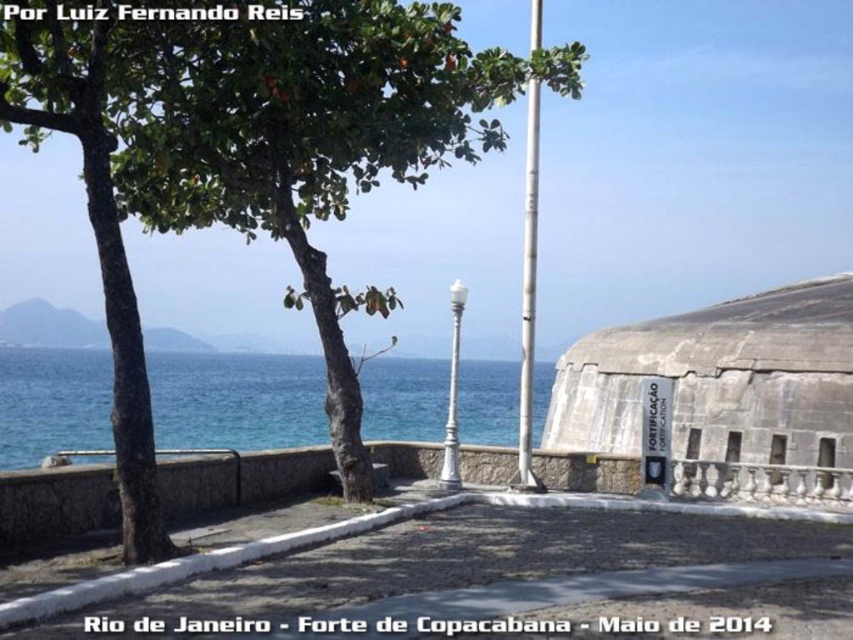
Can you confirm if gray concrete bunker at right is positioned below blue water at center?

Actually, gray concrete bunker at right is above blue water at center.

Which is below, gray concrete bunker at right or blue water at center?

Positioned lower is blue water at center.

This screenshot has height=640, width=853. What do you see at coordinates (726, 394) in the screenshot? I see `gray concrete bunker at right` at bounding box center [726, 394].

Where is `gray concrete bunker at right`? This screenshot has width=853, height=640. gray concrete bunker at right is located at coordinates (726, 394).

Which is more to the left, green leafy tree at left or gray concrete bunker at right?

green leafy tree at left is more to the left.

Is green leafy tree at left smaller than gray concrete bunker at right?

No, green leafy tree at left is not smaller than gray concrete bunker at right.

Is point (235, 51) behind point (711, 396)?

That is False.

This screenshot has width=853, height=640. Find the location of `green leafy tree at left`. green leafy tree at left is located at coordinates (248, 154).

In the scene shown: Is green leafy tree at left smaller than blue water at center?

No.

Between green leafy tree at left and blue water at center, which one has less height?

blue water at center

I want to click on green leafy tree at left, so click(248, 154).

Locate an element on the screen. green leafy tree at left is located at coordinates (248, 154).